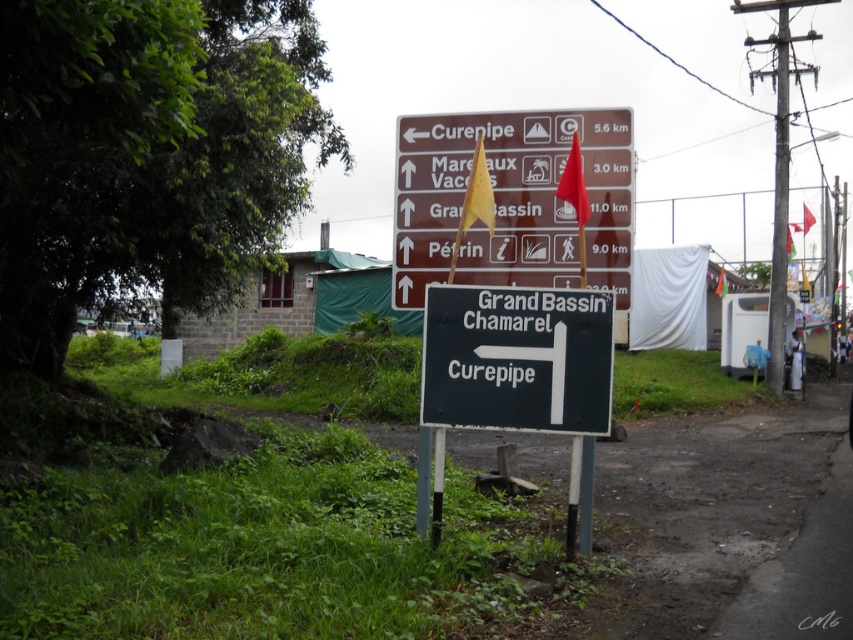
Question: Does brown wooden sign at center lie in front of black plastic sign at center?

Choices:
 (A) yes
 (B) no

Answer: (B)

Question: Among these points, which one is nearest to the camera?

Choices:
 (A) (578, 188)
 (B) (462, 340)
 (C) (563, 250)

Answer: (B)

Question: Can you confirm if brown wooden sign at center is positioned to the right of red fabric flag at center?

Choices:
 (A) yes
 (B) no

Answer: (B)

Question: Among these points, which one is farthest from the camera?

Choices:
 (A) (555, 128)
 (B) (566, 168)
 (C) (485, 323)

Answer: (A)

Question: Is brown wooden sign at center to the left of red fabric flag at center from the viewer's perspective?

Choices:
 (A) no
 (B) yes

Answer: (B)

Question: Based on their relative distances, which object is nearer to the red fabric flag at center?

Choices:
 (A) black plastic sign at center
 (B) brown wooden sign at center

Answer: (B)